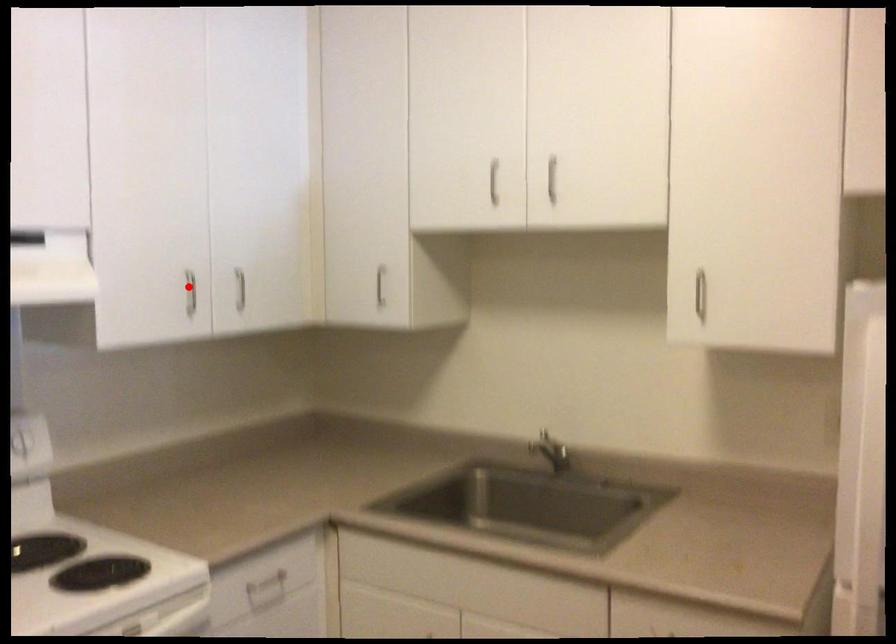
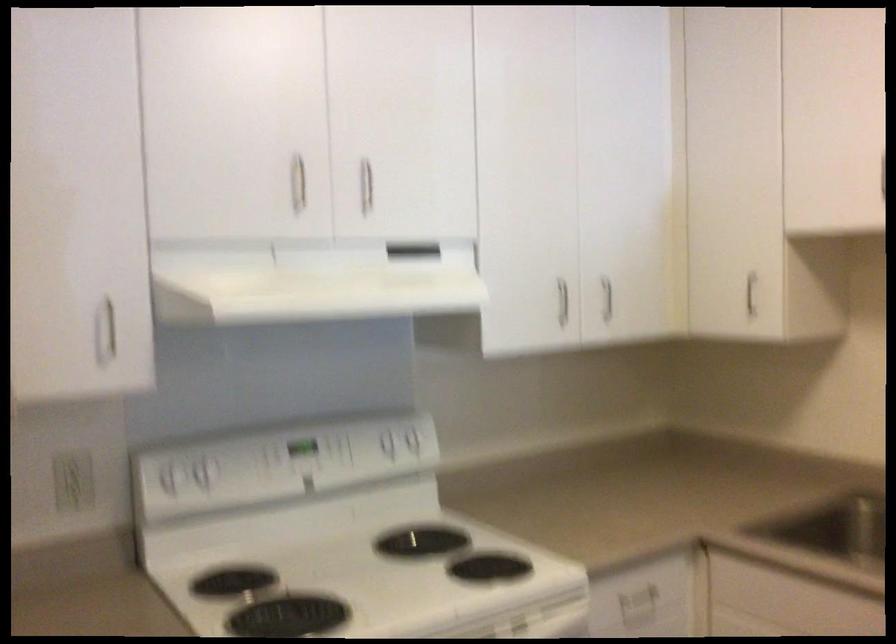
Locate, in the second image, the point that corresponds to the highlighted location in the first image.

(562, 301)